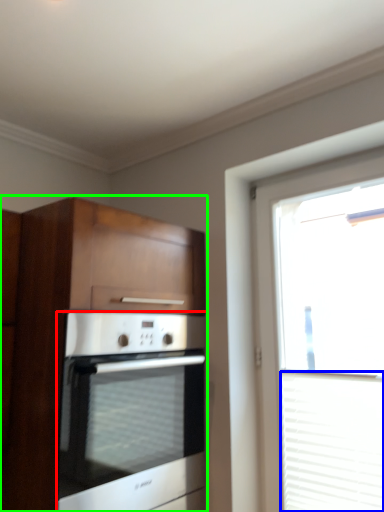
Question: Based on their relative distances, which object is nearer to oven (highlighted by a red box)? Choose from blind (highlighted by a blue box) and cabinetry (highlighted by a green box).

Choices:
 (A) blind
 (B) cabinetry

Answer: (B)